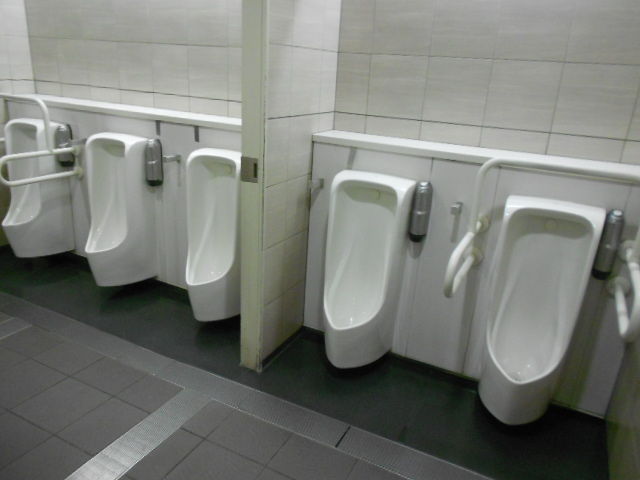
This screenshot has height=480, width=640. Find the location of `urinals`. urinals is located at coordinates (553, 337), (345, 256), (226, 220), (105, 185), (22, 210).